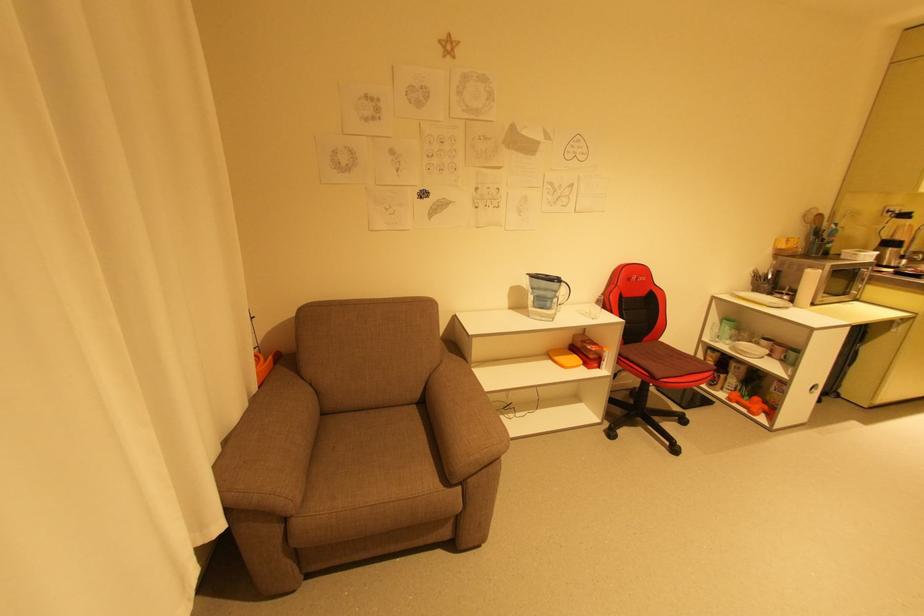
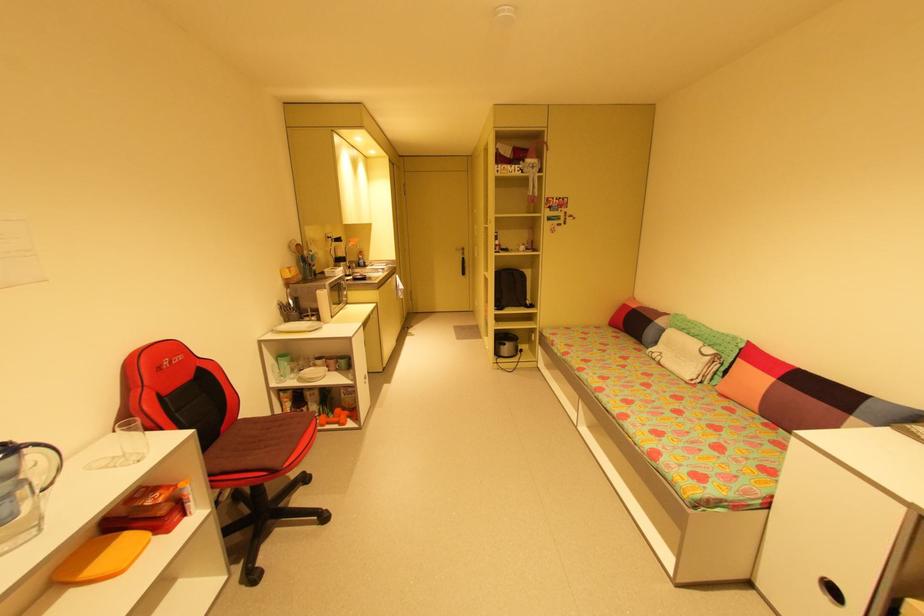
In the second image, find the point that corresponds to point (664, 339) in the first image.

(244, 418)